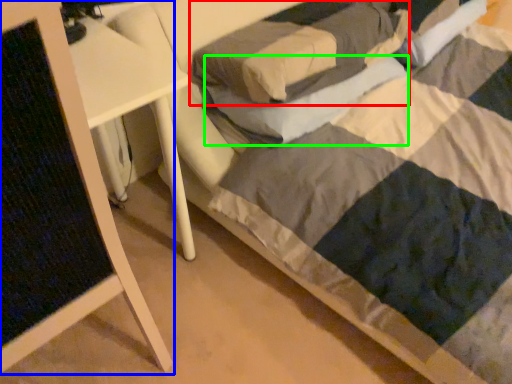
Question: Based on their relative distances, which object is nearer to pillow (highlighted by a red box)? Choose from furniture (highlighted by a blue box) and pillow (highlighted by a green box).

Choices:
 (A) furniture
 (B) pillow

Answer: (B)